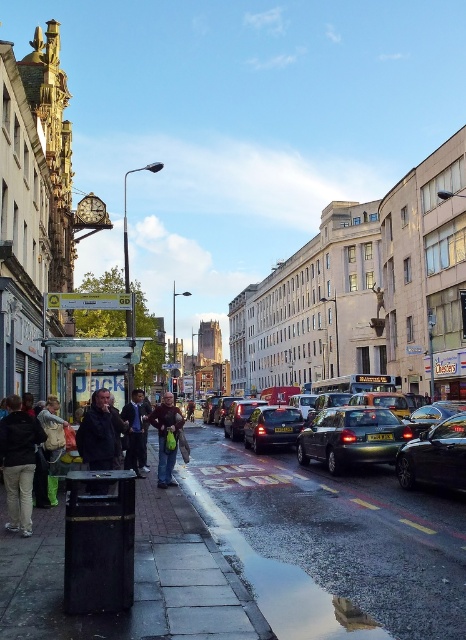
Question: Does shiny black car at center appear on the right side of dark blue jacket at center?

Choices:
 (A) yes
 (B) no

Answer: (A)

Question: In this image, where is green fabric jacket at left located relative to metallic silver taxi at center?

Choices:
 (A) above
 (B) below

Answer: (A)

Question: Can you confirm if concrete sidewalk at lower left is positioned above brown leather jacket at center?

Choices:
 (A) no
 (B) yes

Answer: (A)

Question: Based on their relative distances, which object is nearer to the concrete sidewalk at lower left?

Choices:
 (A) brown leather jacket at center
 (B) dark gray jacket at center
 (C) dark blue jacket at center
 (D) green fabric jacket at left

Answer: (C)

Question: Estimate the real-world distances between objects in this image. Which object is farther from the shiny black car at right?

Choices:
 (A) shiny metallic car at center
 (B) shiny black car at center
 (C) brown leather jacket at center
 (D) dark gray jacket at center

Answer: (D)

Question: Based on their relative distances, which object is farther from the dark gray jacket at lower left?

Choices:
 (A) shiny black car at center
 (B) dark gray jacket at center

Answer: (A)